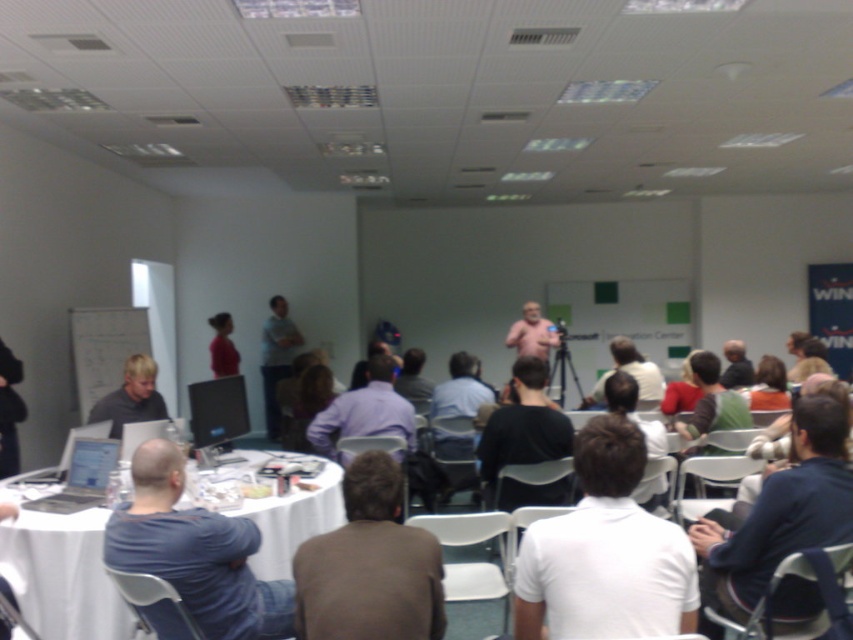
You are a service robot with a height of 5 feet. You need to deliver a document to the dark blue shirt at lower right, but there is a white fabric table at lower left in your path. Can you pass by the table without bending down?

The distance between the white fabric table at lower left and dark blue shirt at lower right is 6.95 feet. Since the robot is 5 feet tall and the table is likely at a standard table height, which is around 2.5 to 3 feet, the robot can pass under the table without needing to bend down.

You are organizing a photo shoot and need to arrange the white matte shirt at center and dark blue shirt at lower left in a line. Which shirt should be placed in front to ensure both are visible in the photo?

The white matte shirt at center should be placed in front of the dark blue shirt at lower left because it is shorter, allowing both shirts to be visible in the photo.